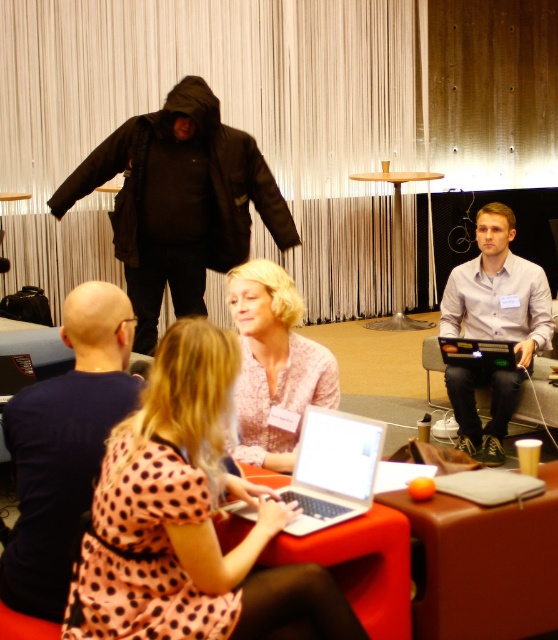
How distant is orange leather table at lower center from wooden table at center?

orange leather table at lower center and wooden table at center are 4.70 meters apart from each other.

I want to click on orange leather table at lower center, so click(485, 564).

You are a GUI agent. You are given a task and a screenshot of the screen. Output one action in this format:
    pyautogui.click(x=<x>, y=<y>)
    Task: Click on the orange leather table at lower center
    The height and width of the screenshot is (640, 558).
    Given the screenshot: What is the action you would take?
    pyautogui.click(x=485, y=564)

Between point (68, 502) and point (526, 394), which one is positioned in front?

Positioned in front is point (68, 502).

Looking at this image, does dark blue shirt at center appear under smooth wooden table at center?

Actually, dark blue shirt at center is above smooth wooden table at center.

Who is more distant from viewer, (117, 292) or (483, 403)?

Positioned behind is point (483, 403).

Where is `dark blue shirt at center`? Image resolution: width=558 pixels, height=640 pixels. dark blue shirt at center is located at coordinates pyautogui.click(x=64, y=445).

Image resolution: width=558 pixels, height=640 pixels. Describe the element at coordinates (189, 520) in the screenshot. I see `pink dotted dress at center` at that location.

Can you confirm if pink dotted dress at center is positioned below white shirt at center?

Indeed, pink dotted dress at center is positioned under white shirt at center.

Which is behind, point (113, 586) or point (472, 403)?

The point (472, 403) is behind.

Locate an element on the screen. This screenshot has height=640, width=558. pink dotted dress at center is located at coordinates (189, 520).